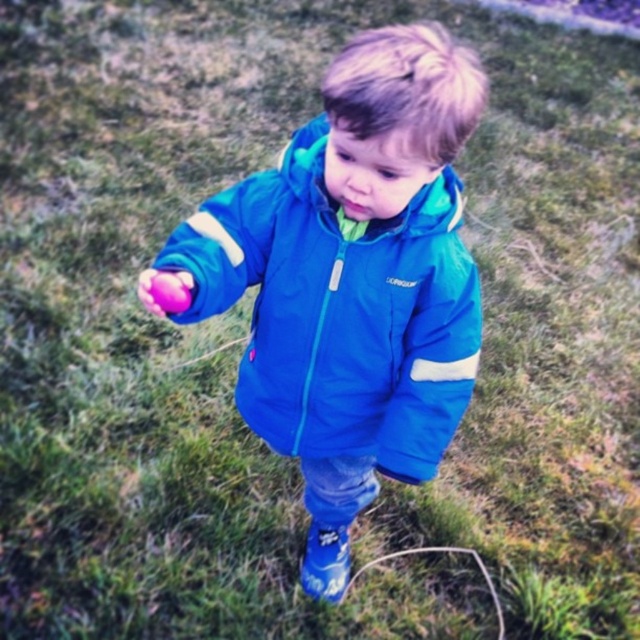
In the scene shown: You are a photographer taking a picture of the blue fabric jacket at center and the shiny purple ball at center. Which object will appear closer to the camera in the photo?

The blue fabric jacket at center will appear closer to the camera because the shiny purple ball at center is behind it.

You are a photographer trying to capture a shot of the shiny purple ball at center and the blue fabric jacket at center. Which object should you focus on first if you want to photograph the one that is more to the left?

The shiny purple ball at center is more to the left than the blue fabric jacket at center, so you should focus on the shiny purple ball at center first.